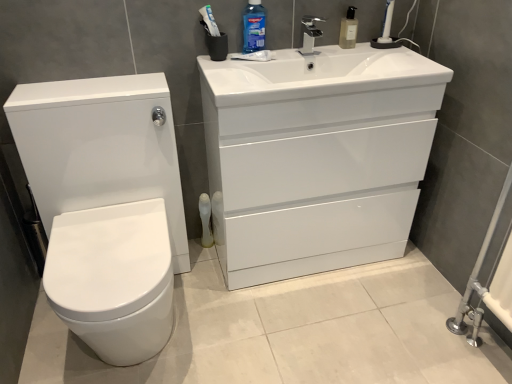
Question: Looking at the image, does white glossy toilet at left seem bigger or smaller compared to blue glossy mouthwash at upper center, the 2th cleaning product from the right?

Choices:
 (A) big
 (B) small

Answer: (A)

Question: Considering the positions of white glossy toilet at left and blue glossy mouthwash at upper center, the 2th cleaning product from the right, in the image, is white glossy toilet at left taller or shorter than blue glossy mouthwash at upper center, the 2th cleaning product from the right,?

Choices:
 (A) tall
 (B) short

Answer: (A)

Question: Which is farther from the white glossy cabinet at upper right?

Choices:
 (A) translucent plastic soap dispenser at upper center, the first cleaning product from the right
 (B) satin nickel faucet at upper center
 (C) white plastic toilet brush at lower center
 (D) white glossy drawer at center
 (E) blue glossy mouthwash at upper center, the first cleaning product in the left-to-right sequence

Answer: (C)

Question: Which object is the farthest from the white glossy toilet at left?

Choices:
 (A) satin nickel faucet at upper center
 (B) white glossy cabinet at upper right
 (C) white plastic toilet brush at lower center
 (D) white glossy drawer at center
 (E) translucent plastic soap dispenser at upper center, the first cleaning product from the right

Answer: (E)